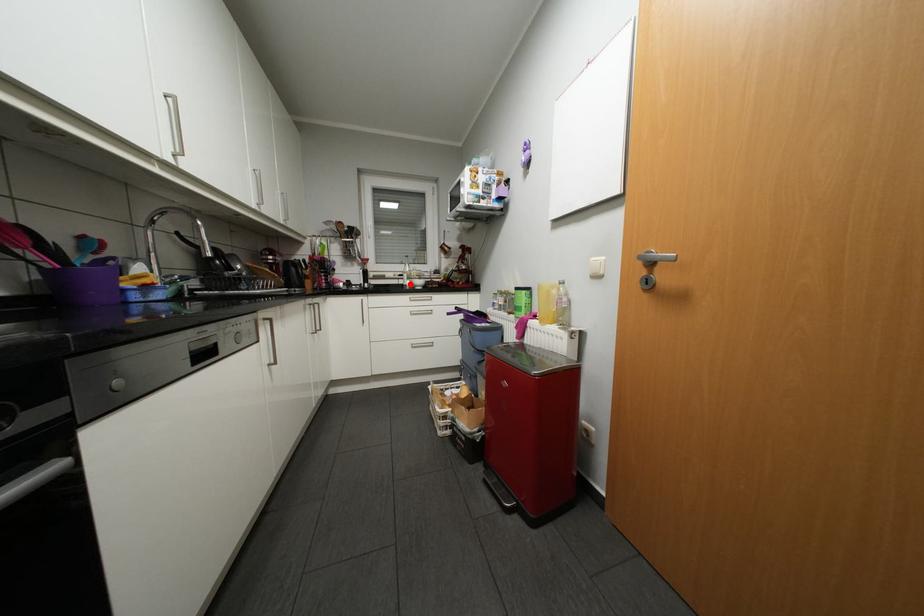
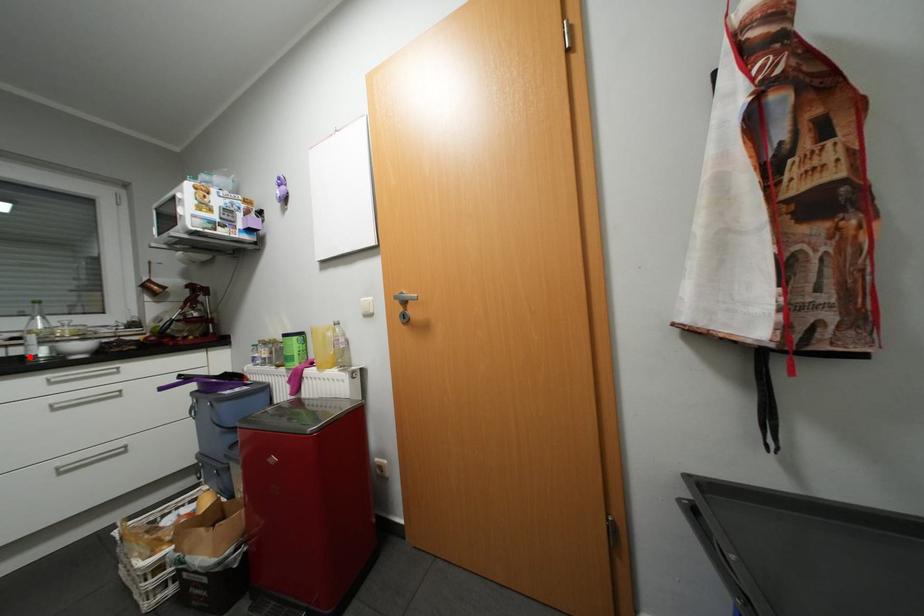
Based on the photo, I am providing you with two images of the same scene from different viewpoints. A red point is marked on the first image and another point is marked on the second image. Are the points marked in image1 and image2 representing the same 3D position?

Yes